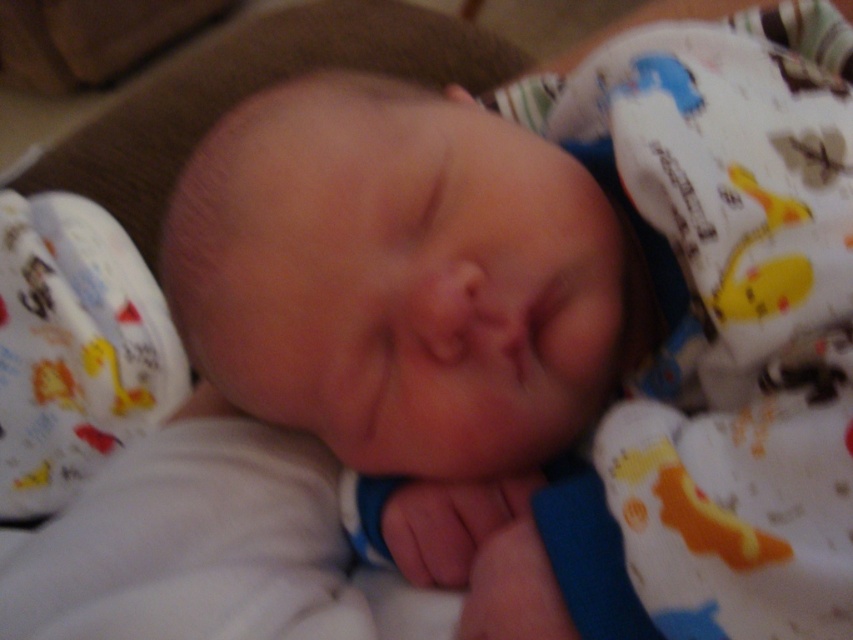
Between white soft newborn at center and white cotton blanket at center, which one appears on the right side from the viewer's perspective?

white cotton blanket at center is more to the right.

The height and width of the screenshot is (640, 853). Describe the element at coordinates (412, 314) in the screenshot. I see `white soft newborn at center` at that location.

This screenshot has width=853, height=640. What are the coordinates of `white soft newborn at center` in the screenshot? It's located at (412, 314).